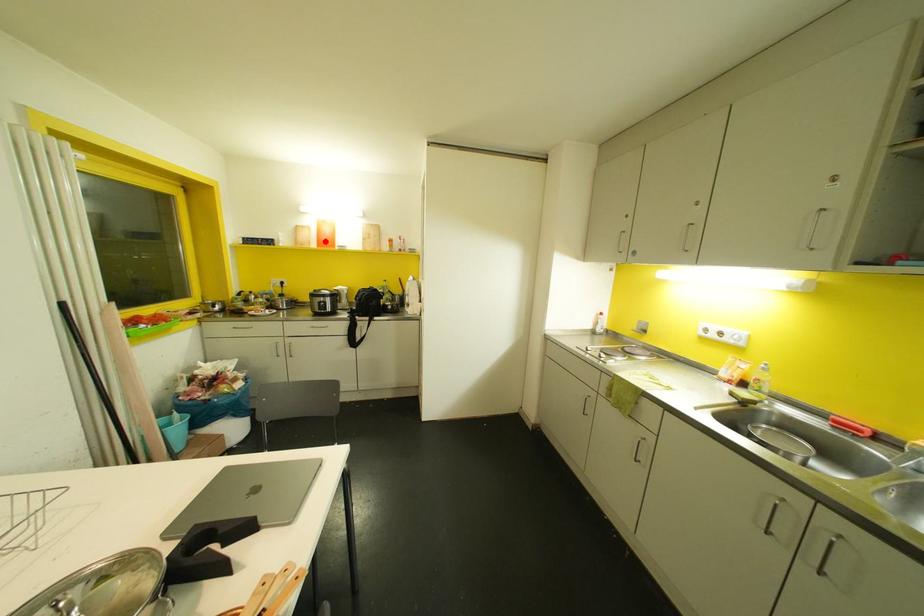
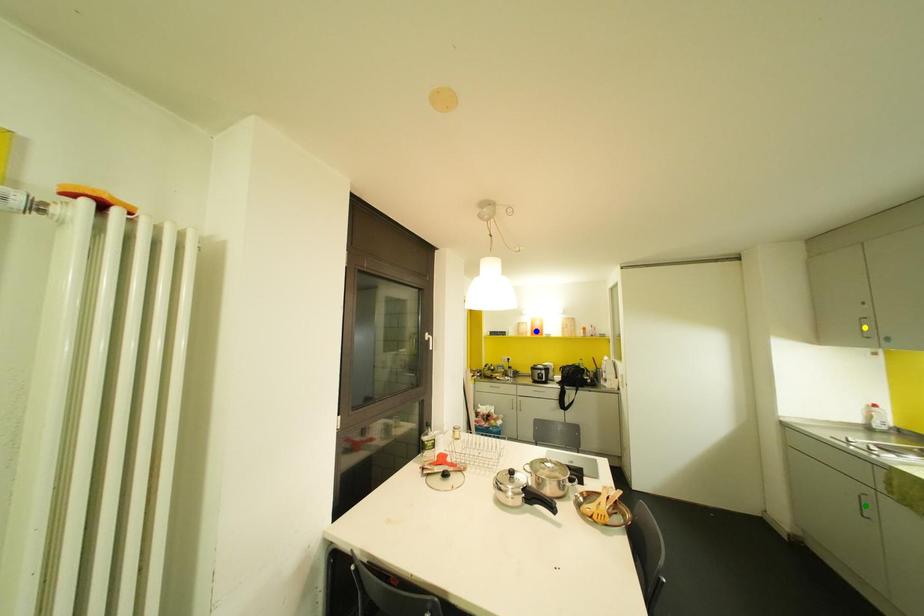
Question: I am providing you with two images of the same scene from different viewpoints. A red point is marked on the first image. You are given multiple points on the second image. In image 2, which mark is for the same physical point as the one in image 1?

Choices:
 (A) blue point
 (B) green point
 (C) yellow point

Answer: (A)